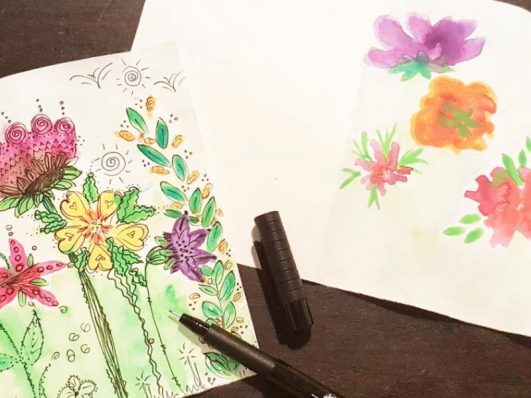
Locate an element on the screen. This screenshot has height=398, width=531. empty brown table is located at coordinates (387, 351).